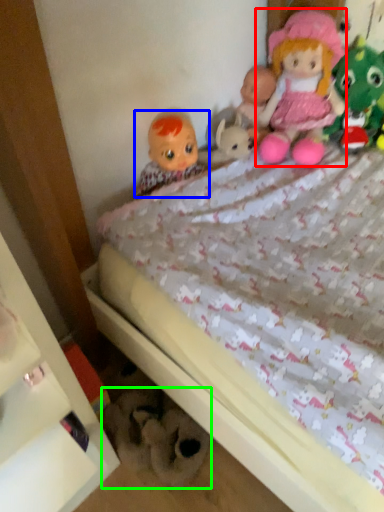
Question: Based on their relative distances, which object is farther from doll (highlighted by a red box)? Choose from doll (highlighted by a blue box) and toy (highlighted by a green box).

Choices:
 (A) doll
 (B) toy

Answer: (B)